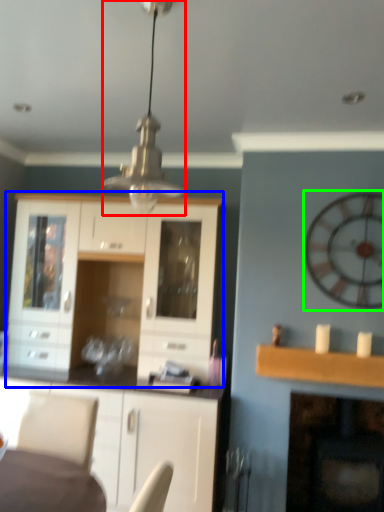
Question: Considering the real-world distances, which object is farthest from light fixture (highlighted by a red box)? cabinetry (highlighted by a blue box) or clock (highlighted by a green box)?

Choices:
 (A) cabinetry
 (B) clock

Answer: (B)